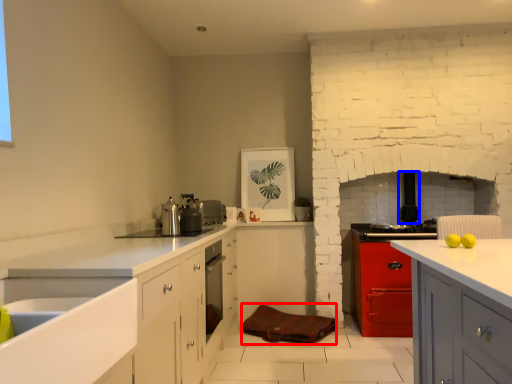
Question: Among these objects, which one is nearest to the camera, material (highlighted by a red box) or appliance (highlighted by a blue box)?

Choices:
 (A) material
 (B) appliance

Answer: (A)